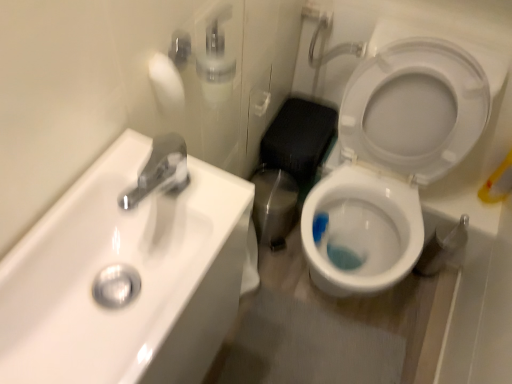
Question: Considering the positions of point (1, 301) and point (450, 49), is point (1, 301) closer or farther from the camera than point (450, 49)?

Choices:
 (A) closer
 (B) farther

Answer: (A)

Question: From a real-world perspective, relative to white glossy toilet at right, is white glossy sink at upper left vertically above or below?

Choices:
 (A) below
 (B) above

Answer: (B)

Question: From their relative heights in the image, would you say white glossy sink at upper left is taller or shorter than white glossy toilet at right?

Choices:
 (A) short
 (B) tall

Answer: (A)

Question: In terms of size, does white glossy toilet at right appear bigger or smaller than white glossy sink at upper left?

Choices:
 (A) big
 (B) small

Answer: (A)

Question: Is white glossy toilet at right to the left or to the right of white glossy sink at upper left in the image?

Choices:
 (A) left
 (B) right

Answer: (B)

Question: From the image's perspective, is white glossy toilet at right positioned above or below white glossy sink at upper left?

Choices:
 (A) below
 (B) above

Answer: (B)

Question: Considering the positions of white glossy toilet at right and white glossy sink at upper left in the image, is white glossy toilet at right taller or shorter than white glossy sink at upper left?

Choices:
 (A) short
 (B) tall

Answer: (B)